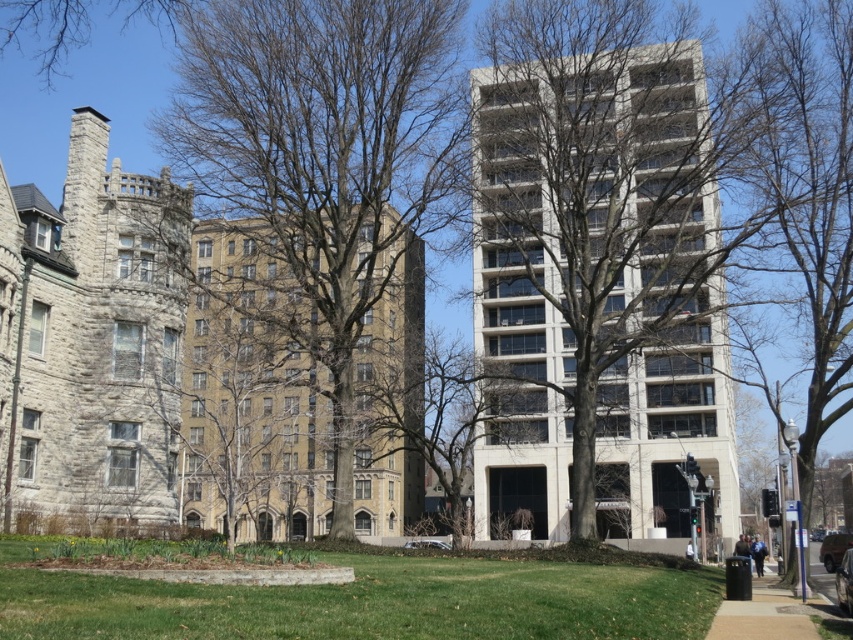
What do you see at coordinates (805, 195) in the screenshot?
I see `bare branches at right` at bounding box center [805, 195].

This screenshot has width=853, height=640. What do you see at coordinates (805, 195) in the screenshot?
I see `bare branches at right` at bounding box center [805, 195].

This screenshot has width=853, height=640. In order to click on bare branches at right in this screenshot , I will do `click(805, 195)`.

Between point (798, 36) and point (730, 627), which one is positioned in front?

Point (730, 627) is in front.

Which is more to the left, bare branches at right or black asphalt sidewalk at lower right?

black asphalt sidewalk at lower right

Who is more distant from viewer, (846,22) or (769,618)?

Point (846,22)

The image size is (853, 640). Identify the location of bare branches at right. (805, 195).

Can you confirm if brown stone building at center is smaller than gray stone chimney at upper left?

No.

Is brown stone building at center taller than gray stone chimney at upper left?

Indeed, brown stone building at center has a greater height compared to gray stone chimney at upper left.

Locate an element on the screen. brown stone building at center is located at coordinates (253, 392).

At what (x,y) coordinates should I click in order to perform the action: click on brown stone building at center. Please return your answer as a coordinate pair (x, y). Looking at the image, I should click on (253, 392).